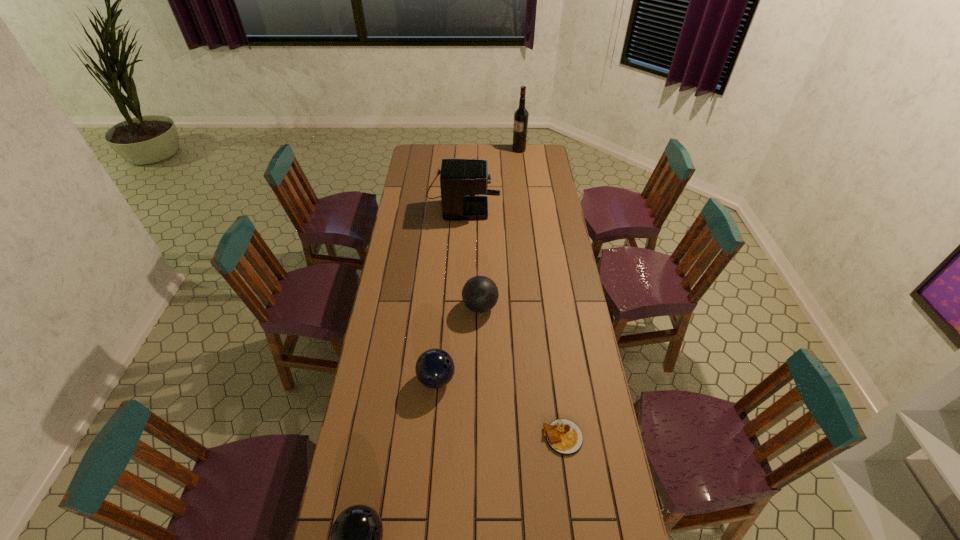
Locate an element on the screen. free point that satisfies the following two spatial constraints: 1. on the front-facing side of the shortest object; 2. on the right side of the coffee maker is located at coordinates (452, 437).

Image resolution: width=960 pixels, height=540 pixels. I want to click on free location that satisfies the following two spatial constraints: 1. on the surface of the shortest object near the finger holes; 2. on the left side of the second nearest bowling ball, so click(432, 437).